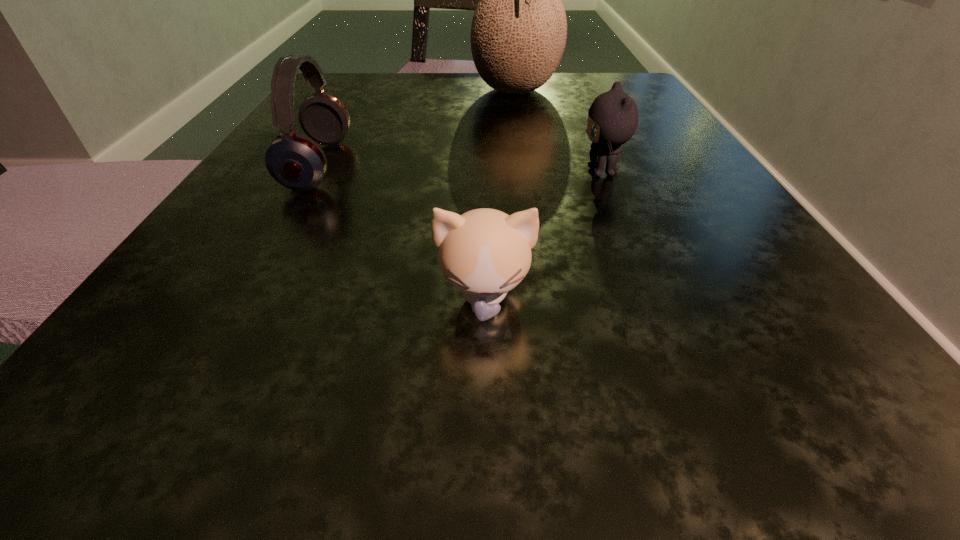
Locate an element on the screen. Image resolution: width=960 pixels, height=540 pixels. the tallest object is located at coordinates (518, 34).

Locate an element on the screen. This screenshot has height=540, width=960. the farthest object is located at coordinates (518, 34).

You are a GUI agent. You are given a task and a screenshot of the screen. Output one action in this format:
    pyautogui.click(x=<x>, y=<y>)
    Task: Click on the earphone
    
    Given the screenshot: What is the action you would take?
    pyautogui.click(x=295, y=161)

The height and width of the screenshot is (540, 960). Find the location of `the second tallest object`. the second tallest object is located at coordinates (295, 161).

Identify the location of the farther kitten. (613, 116).

You are a GUI agent. You are given a task and a screenshot of the screen. Output one action in this format:
    pyautogui.click(x=<x>, y=<y>)
    Task: Click on the left kitten
    The height and width of the screenshot is (540, 960).
    Given the screenshot: What is the action you would take?
    pyautogui.click(x=484, y=253)

The width and height of the screenshot is (960, 540). Identify the location of the nearest object. (484, 253).

Find the location of a particular element. vacant space situated on the left of the farthest object is located at coordinates (415, 91).

You are a GUI agent. You are given a task and a screenshot of the screen. Output one action in this format:
    pyautogui.click(x=<x>, y=<y>)
    Task: Click on the free point located 0.300m on the ear cups of the earphone
    The height and width of the screenshot is (540, 960).
    Given the screenshot: What is the action you would take?
    click(x=552, y=165)

Where is `vacant space located 0.130m on the front-facing side of the right kitten`? vacant space located 0.130m on the front-facing side of the right kitten is located at coordinates (487, 172).